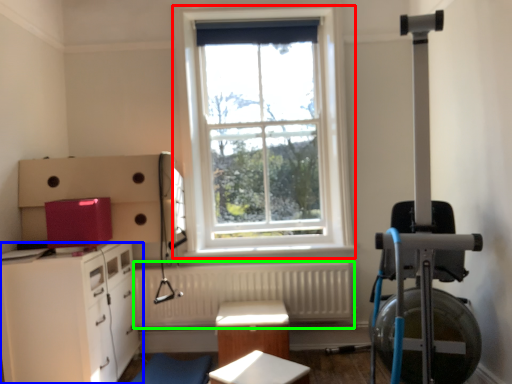
Question: Considering the real-world distances, which object is closest to window (highlighted by a red box)? chest of drawers (highlighted by a blue box) or radiator (highlighted by a green box).

Choices:
 (A) chest of drawers
 (B) radiator

Answer: (B)